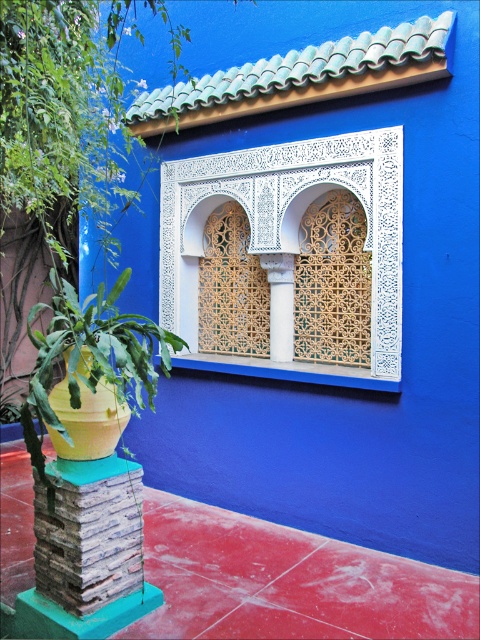
You are an architect designing a new building and want to incorporate both the white lattice window at center and the white stone column at center into your design. Based on the image, which of these two elements should you scale down in size to maintain a balanced architectural composition?

The white lattice window at center is larger than the white stone column at center. To maintain balance, you should scale down the white lattice window at center.

You are an architect designing a new building inspired by the image. You need to place a white stone column at center and a white lattice window at center in your design. According to the original image, which object should be placed to the left?

The white lattice window at center should be placed to the left of the white stone column at center because in the original image, the white lattice window at center is positioned on the left side of the white stone column at center.